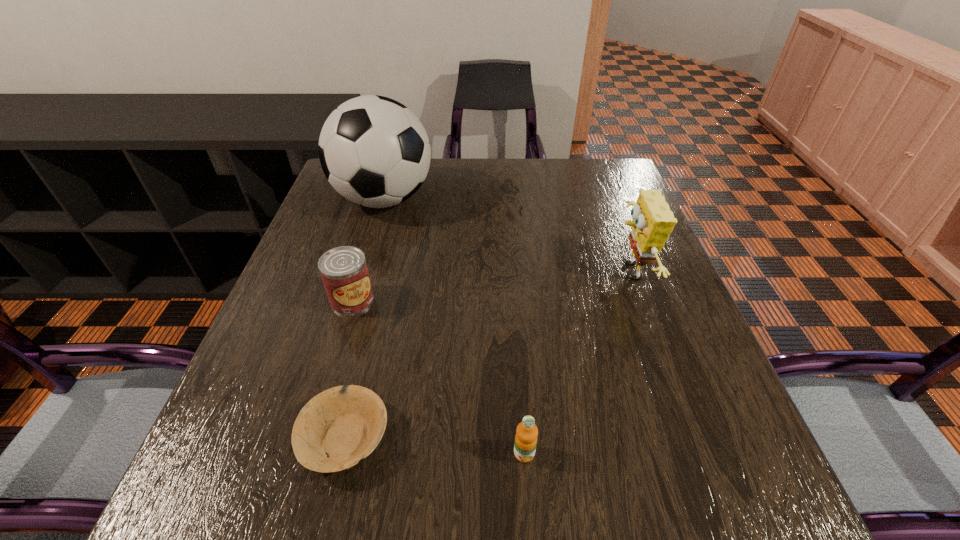
Find the location of a particular element. The width and height of the screenshot is (960, 540). object that is positioned at the far left corner is located at coordinates (374, 151).

Identify the location of object that is at the near left corner. The image size is (960, 540). (335, 429).

In the image, there is a desktop. What are the coordinates of `vacant space at the far edge` in the screenshot? It's located at click(513, 159).

At what (x,y) coordinates should I click in order to perform the action: click on vacant space at the near edge of the desktop. Please return your answer as a coordinate pair (x, y). The width and height of the screenshot is (960, 540). Looking at the image, I should click on (338, 484).

At what (x,y) coordinates should I click in order to perform the action: click on blank area at the left edge. Please return your answer as a coordinate pair (x, y). Looking at the image, I should click on (260, 335).

The image size is (960, 540). Find the location of `vacant area at the right edge of the desktop`. vacant area at the right edge of the desktop is located at coordinates (689, 360).

Find the location of a particular element. free space at the far right corner of the desktop is located at coordinates (609, 167).

What are the coordinates of `vacant space that's between the soccer ball and the sponge` in the screenshot? It's located at 506,236.

Image resolution: width=960 pixels, height=540 pixels. In order to click on free space between the can and the soccer ball in this screenshot , I will do coord(369,249).

Locate an element on the screen. empty location between the soccer ball and the shortest object is located at coordinates (365, 319).